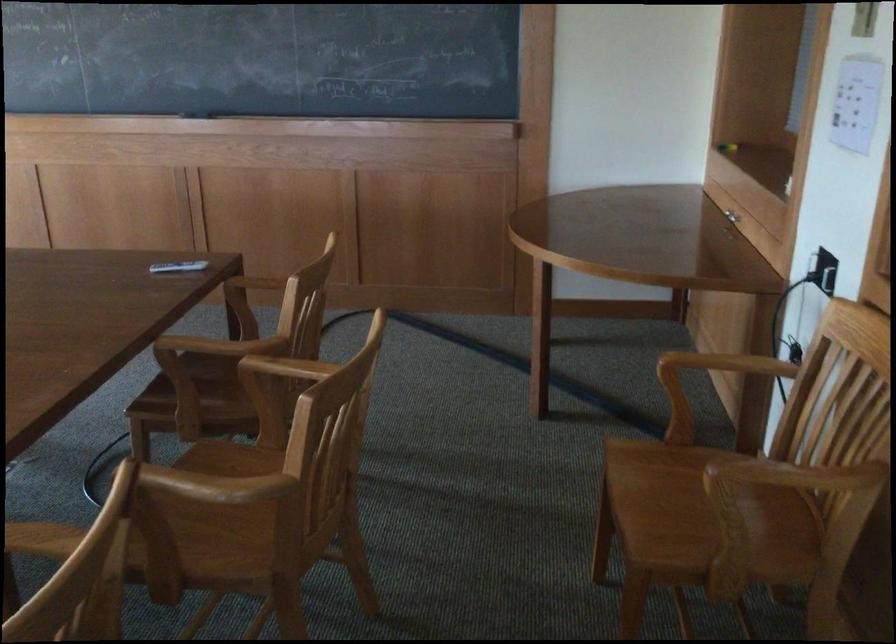
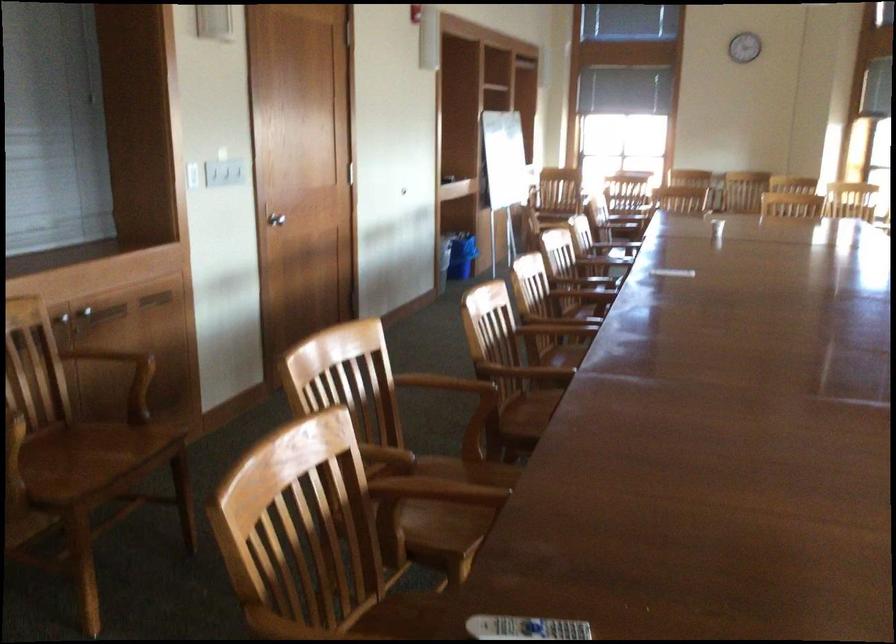
Question: I am providing you with two images of the same scene from different viewpoints. Please identify which objects are invisible in image2.

Choices:
 (A) blue trash can
 (B) cabinet handle
 (C) wooden chair armrest
 (D) none of these

Answer: (D)